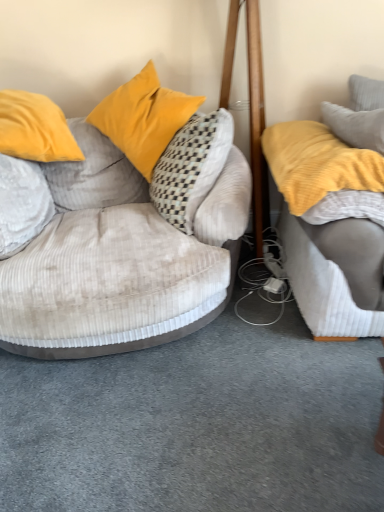
Question: Considering the positions of soft white pillow at left, positioned as the 4th pillow in right-to-left order, and velvet yellow pillow at upper left, which is counted as the second pillow, starting from the left, in the image, is soft white pillow at left, positioned as the 4th pillow in right-to-left order, taller or shorter than velvet yellow pillow at upper left, which is counted as the second pillow, starting from the left,?

Choices:
 (A) short
 (B) tall

Answer: (A)

Question: Looking at their shapes, would you say soft white pillow at left, the 1th pillow from the left, is wider or thinner than velvet yellow pillow at upper left, which is counted as the second pillow, starting from the left?

Choices:
 (A) wide
 (B) thin

Answer: (B)

Question: Estimate the real-world distances between objects in this image. Which object is closer to the velvet yellow pillow at upper left, which is the third pillow in right-to-left order?

Choices:
 (A) soft white pillow at left, the 1th pillow from the left
 (B) gray textured pillow at upper right, the fourth pillow positioned from the left
 (C) yellow soft fabric studio couch at right, which ranks as the second studio couch in left-to-right order
 (D) velvet beige studio couch at left, which is counted as the first studio couch, starting from the left
 (E) yellow corduroy pillow at right, arranged as the 3th pillow when viewed from the left

Answer: (D)

Question: Which object is the closest to the velvet yellow pillow at upper left, which is the third pillow in right-to-left order?

Choices:
 (A) gray textured pillow at upper right, the 1th pillow from the right
 (B) soft white pillow at left, the 1th pillow from the left
 (C) yellow soft fabric studio couch at right, which ranks as the second studio couch in left-to-right order
 (D) velvet beige studio couch at left, which is counted as the first studio couch, starting from the left
 (E) yellow corduroy pillow at right, arranged as the 3th pillow when viewed from the left

Answer: (D)